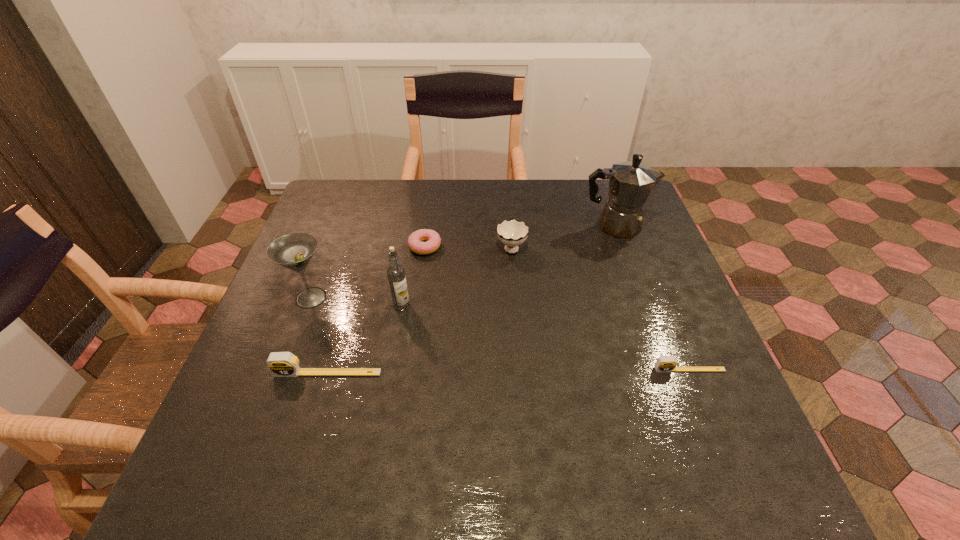
You are a GUI agent. You are given a task and a screenshot of the screen. Output one action in this format:
    pyautogui.click(x=<x>, y=<y>)
    Task: Click on the free region located at the front of the shorter tape measure with the tape extended
    The height and width of the screenshot is (540, 960).
    Given the screenshot: What is the action you would take?
    pyautogui.click(x=714, y=430)

Locate an element on the screen. vacant space located 0.260m on the side of the cup with the handle is located at coordinates (507, 185).

Image resolution: width=960 pixels, height=540 pixels. What are the coordinates of `free spot located on the side of the cup with the handle` in the screenshot? It's located at pyautogui.click(x=509, y=214).

The image size is (960, 540). I want to click on vacant space located on the side of the cup with the handle, so click(508, 202).

This screenshot has height=540, width=960. I want to click on free space located on the label of the vodka, so click(x=386, y=396).

The width and height of the screenshot is (960, 540). Identify the location of vacant space positioned on the left of the doughnut. (384, 247).

Where is `vacant space located 0.340m on the right of the martini`? vacant space located 0.340m on the right of the martini is located at coordinates (470, 298).

Locate an element on the screen. The width and height of the screenshot is (960, 540). object that is at the far edge is located at coordinates (630, 183).

Find the location of a particular element. This screenshot has width=960, height=540. tape measure present at the left edge is located at coordinates (281, 364).

Locate an element on the screen. This screenshot has height=540, width=960. martini located at the left edge is located at coordinates (294, 251).